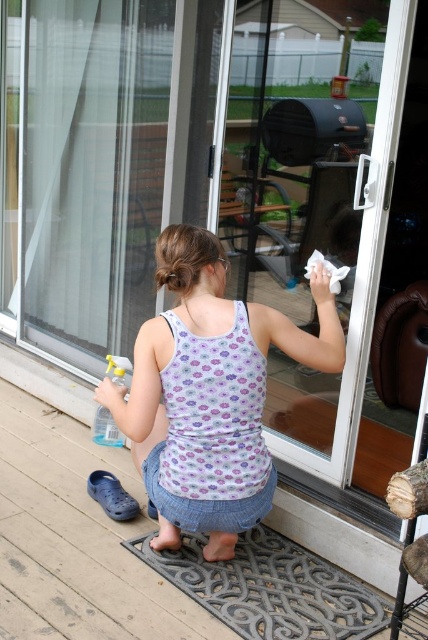
From the picture: You are trying to determine the order of two points on the sliding door. Given that you are facing the door, which point, point 1 at coordinates (246, 456) or point 2 at coordinates (115, 442), is closer to you?

Point 1 at coordinates (246, 456) is closer to you because it is in front of point 2 at coordinates (115, 442).

The girl is wearing a floral tank top at center and holding a clear plastic spray bottle at lower left. Which item is larger in size?

The floral tank top at center is bigger than the clear plastic spray bottle at lower left.

You are standing on the wooden deck at lower left. Looking at the scene described, where exactly are you positioned in terms of coordinates?

You are positioned at the coordinates [74,541] on the wooden deck at lower left.